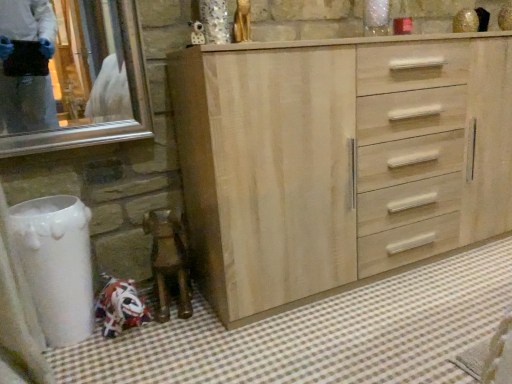
Question: From a real-world perspective, relative to white checkered bath mat at lower left, is light wood cabinet at center vertically above or below?

Choices:
 (A) above
 (B) below

Answer: (A)

Question: Looking at their shapes, would you say light wood cabinet at center is wider or thinner than white checkered bath mat at lower left?

Choices:
 (A) wide
 (B) thin

Answer: (B)

Question: In terms of size, does light wood cabinet at center appear bigger or smaller than white checkered bath mat at lower left?

Choices:
 (A) big
 (B) small

Answer: (A)

Question: Considering the positions of white checkered bath mat at lower left and light wood cabinet at center in the image, is white checkered bath mat at lower left wider or thinner than light wood cabinet at center?

Choices:
 (A) wide
 (B) thin

Answer: (A)

Question: From the image's perspective, is white checkered bath mat at lower left above or below light wood cabinet at center?

Choices:
 (A) below
 (B) above

Answer: (A)

Question: Would you say white checkered bath mat at lower left is to the left or to the right of light wood cabinet at center in the picture?

Choices:
 (A) left
 (B) right

Answer: (A)

Question: From a real-world perspective, relative to light wood cabinet at center, is white checkered bath mat at lower left vertically above or below?

Choices:
 (A) above
 (B) below

Answer: (B)